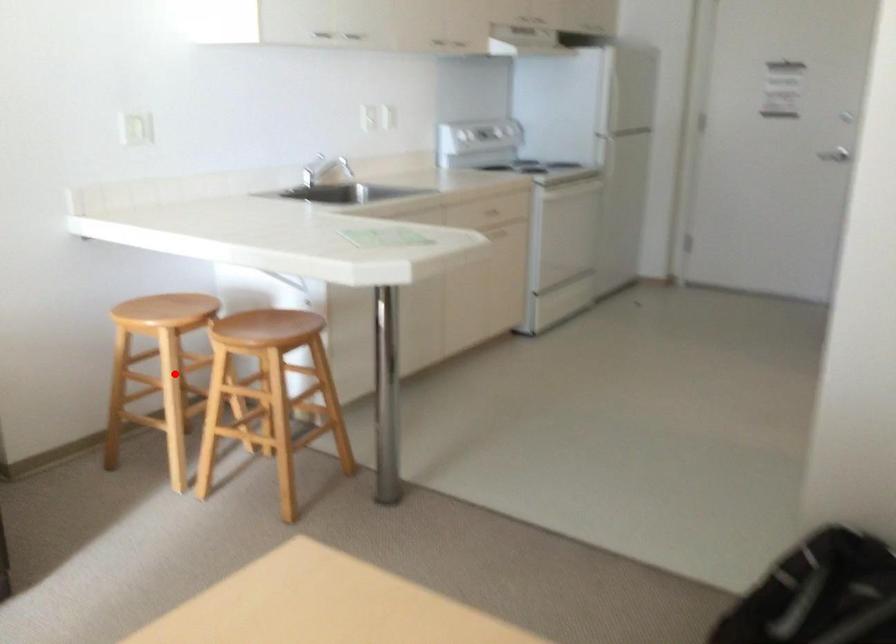
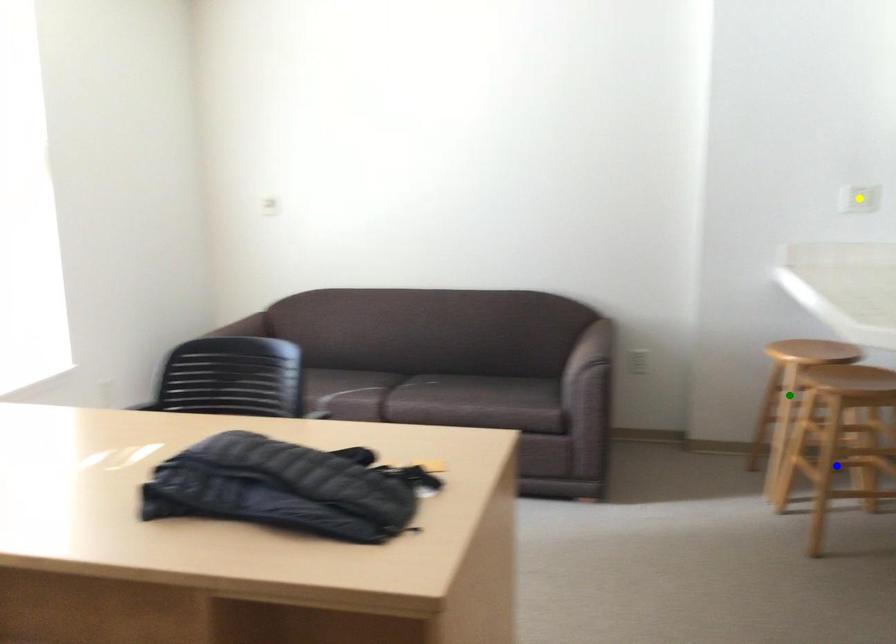
Question: I am providing you with two images of the same scene from different viewpoints. A red point is marked on the first image. You are given multiple points on the second image. In image 2, which mark is for the same physical point as the one in image 1?

Choices:
 (A) blue point
 (B) green point
 (C) yellow point

Answer: (B)